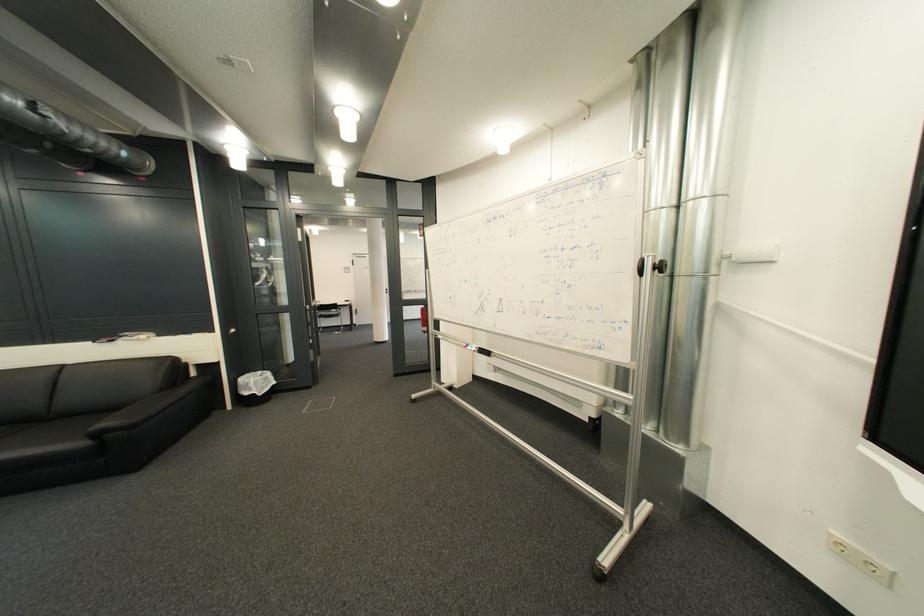
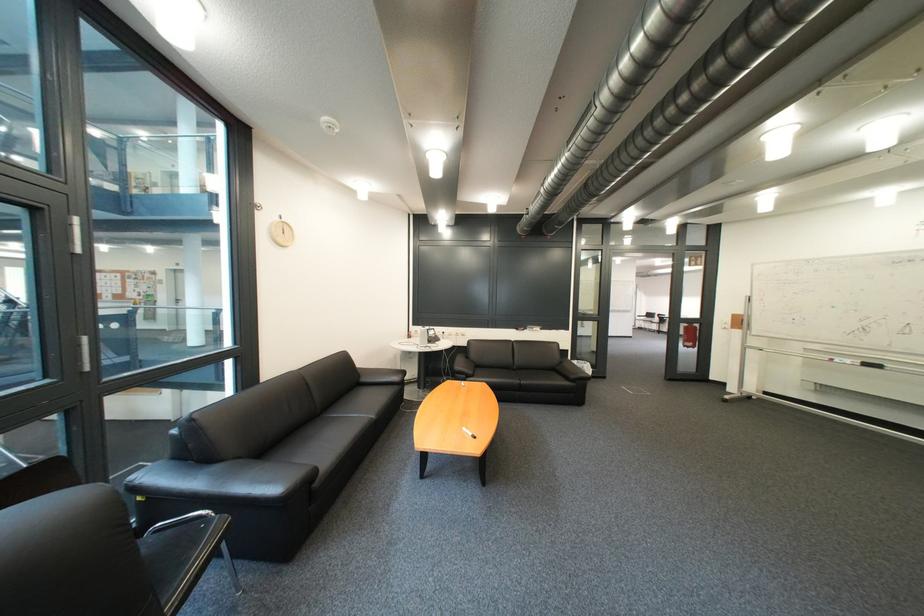
Where in the second image is the point corresponding to [495,353] from the first image?

(881, 366)